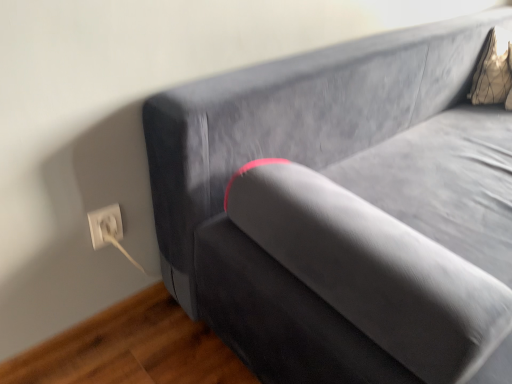
Question: Does white plastic electric outlet at lower left have a lesser height compared to gold textured pillow at upper right?

Choices:
 (A) no
 (B) yes

Answer: (B)

Question: Is white plastic electric outlet at lower left far from gold textured pillow at upper right?

Choices:
 (A) yes
 (B) no

Answer: (A)

Question: Is white plastic electric outlet at lower left further to camera compared to gold textured pillow at upper right?

Choices:
 (A) no
 (B) yes

Answer: (A)

Question: Considering the relative positions of white plastic electric outlet at lower left and gold textured pillow at upper right in the image provided, is white plastic electric outlet at lower left in front of gold textured pillow at upper right?

Choices:
 (A) no
 (B) yes

Answer: (B)

Question: Could you tell me if white plastic electric outlet at lower left is turned towards gold textured pillow at upper right?

Choices:
 (A) no
 (B) yes

Answer: (A)

Question: Would you say gold textured pillow at upper right is part of white plastic electric outlet at lower left's contents?

Choices:
 (A) no
 (B) yes

Answer: (A)

Question: Is gold textured pillow at upper right positioned beyond the bounds of white plastic electric outlet at lower left?

Choices:
 (A) yes
 (B) no

Answer: (A)

Question: Considering the relative sizes of gold textured pillow at upper right and white plastic electric outlet at lower left in the image provided, is gold textured pillow at upper right wider than white plastic electric outlet at lower left?

Choices:
 (A) yes
 (B) no

Answer: (A)

Question: Does gold textured pillow at upper right come behind white plastic electric outlet at lower left?

Choices:
 (A) no
 (B) yes

Answer: (B)

Question: Is gold textured pillow at upper right closer to the viewer compared to white plastic electric outlet at lower left?

Choices:
 (A) yes
 (B) no

Answer: (B)

Question: Is gold textured pillow at upper right bigger than white plastic electric outlet at lower left?

Choices:
 (A) yes
 (B) no

Answer: (A)

Question: Can you confirm if gold textured pillow at upper right is smaller than white plastic electric outlet at lower left?

Choices:
 (A) no
 (B) yes

Answer: (A)

Question: In terms of width, does white plastic electric outlet at lower left look wider or thinner when compared to gold textured pillow at upper right?

Choices:
 (A) wide
 (B) thin

Answer: (B)